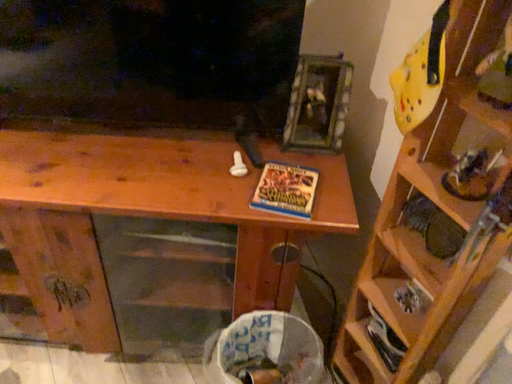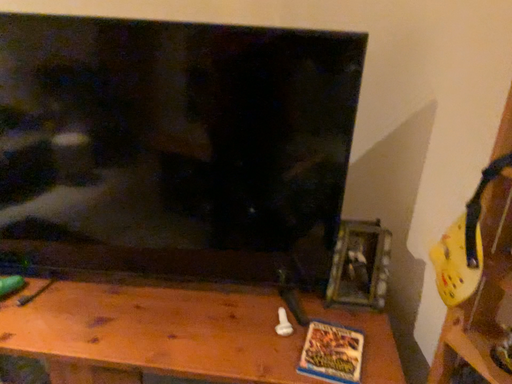
Question: Which way did the camera rotate in the video?

Choices:
 (A) rotated upward
 (B) rotated downward

Answer: (A)